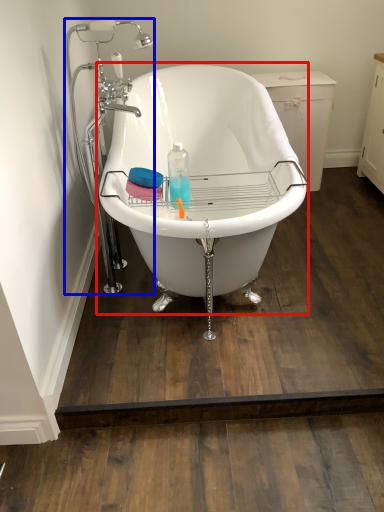
Question: Among these objects, which one is farthest to the camera, bathtub (highlighted by a red box) or faucet (highlighted by a blue box)?

Choices:
 (A) bathtub
 (B) faucet

Answer: (B)